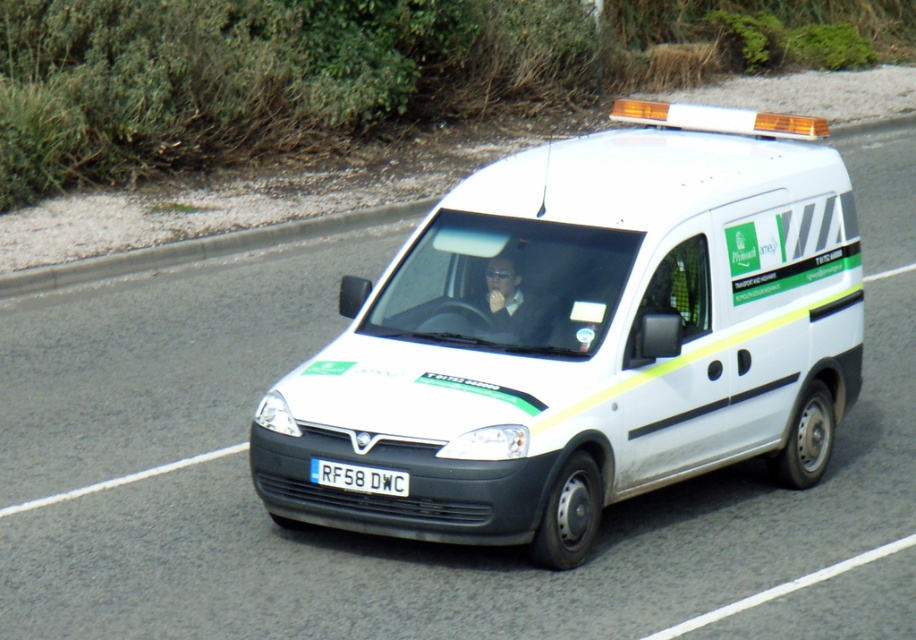
Question: Can you confirm if white matte van at center is positioned above white plastic license plate at center?

Choices:
 (A) yes
 (B) no

Answer: (A)

Question: Which of the following is the farthest from the observer?

Choices:
 (A) white plastic license plate at center
 (B) white matte van at center

Answer: (A)

Question: Does white matte van at center lie behind white plastic license plate at center?

Choices:
 (A) yes
 (B) no

Answer: (B)

Question: Is white matte van at center below white plastic license plate at center?

Choices:
 (A) yes
 (B) no

Answer: (B)

Question: Among these points, which one is farthest from the camera?

Choices:
 (A) (319, 472)
 (B) (689, 296)

Answer: (B)